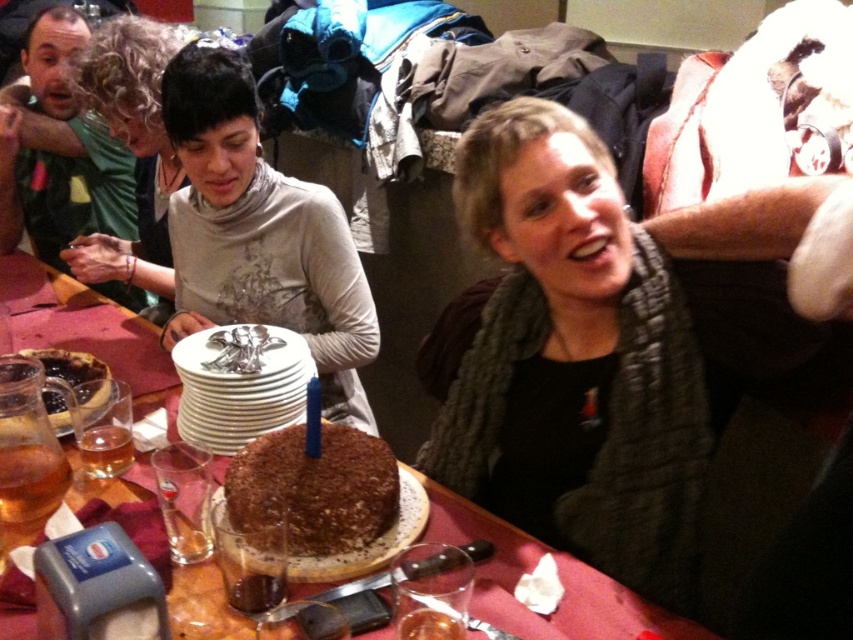
Consider the image. You are a guest at the celebration and want to choose the taller cake between the chocolate crumbly cake at center and the brown crumbly cake at center. Which one should you choose?

The chocolate crumbly cake at center is taller than the brown crumbly cake at center, so you should choose the chocolate crumbly cake at center.

You are a guest at this celebration and want to reach the brown crumbly cake at center to take a piece. However, there is a knitted gray scarf at upper right in the way. Can you easily access the cake without moving the scarf?

The knitted gray scarf at upper right is positioned over the brown crumbly cake at center, so it is blocking access to the cake. You would need to move the scarf to reach the cake.